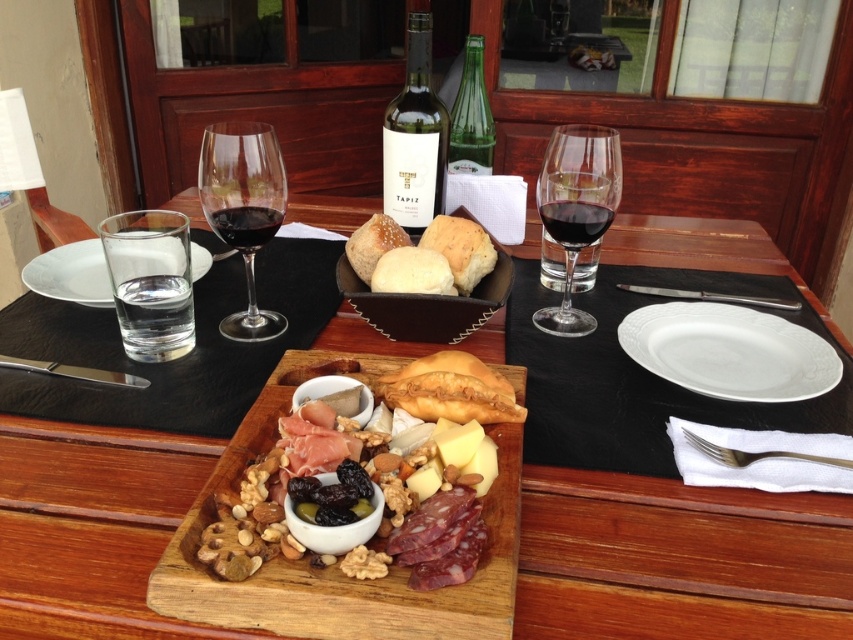
Is matte glass bottle at center positioned behind silver/golden metal fork at lower right?

Yes.

Does matte glass bottle at center have a greater width compared to silver/golden metal fork at lower right?

Incorrect, matte glass bottle at center's width does not surpass silver/golden metal fork at lower right's.

Does point (410, 132) come in front of point (842, 460)?

No, (410, 132) is further to viewer.

This screenshot has height=640, width=853. I want to click on matte glass bottle at center, so click(x=415, y=138).

Image resolution: width=853 pixels, height=640 pixels. What do you see at coordinates (335, 564) in the screenshot? I see `wooden tray at center` at bounding box center [335, 564].

Between wooden tray at center and white porcelain plate at center, which one appears on the left side from the viewer's perspective?

wooden tray at center

What do you see at coordinates (335, 564) in the screenshot? The image size is (853, 640). I see `wooden tray at center` at bounding box center [335, 564].

Image resolution: width=853 pixels, height=640 pixels. Find the location of `wooden tray at center`. wooden tray at center is located at coordinates (335, 564).

Does translucent glass wine at upper right have a lesser height compared to silver/golden metal fork at lower right?

Incorrect, translucent glass wine at upper right's height does not fall short of silver/golden metal fork at lower right's.

Describe the element at coordinates (573, 221) in the screenshot. I see `translucent glass wine at upper right` at that location.

Is point (540, 218) farther from viewer compared to point (712, 458)?

Yes.

Find the location of a particular element. Image resolution: width=853 pixels, height=640 pixels. translucent glass wine at upper right is located at coordinates (573, 221).